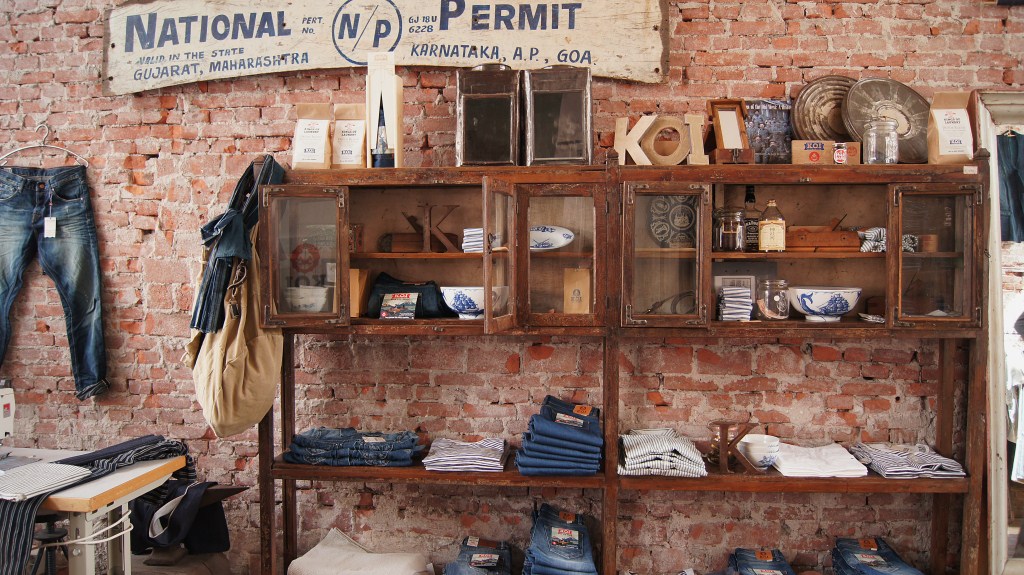
Locate an element on the screen. The image size is (1024, 575). glass is located at coordinates (313, 252), (495, 285), (569, 259), (657, 264), (927, 283).